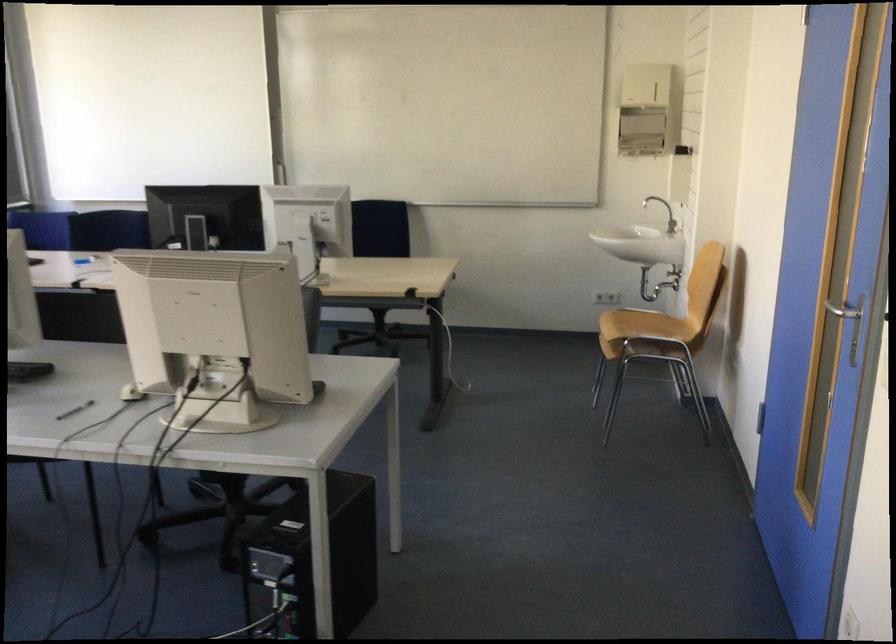
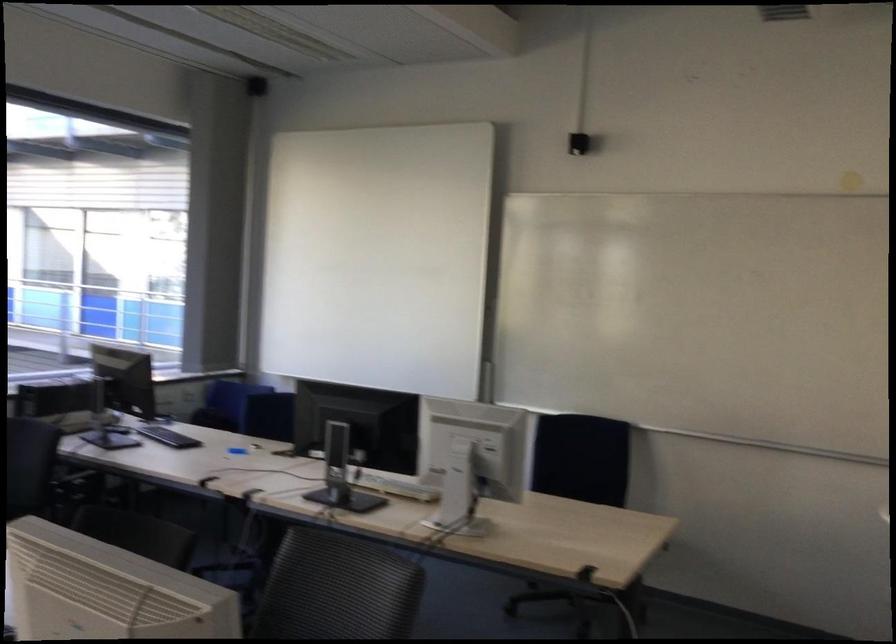
Question: The images are taken continuously from a first-person perspective. In which direction are you moving?

Choices:
 (A) Left
 (B) Right
 (C) Forward
 (D) Backward

Answer: (C)